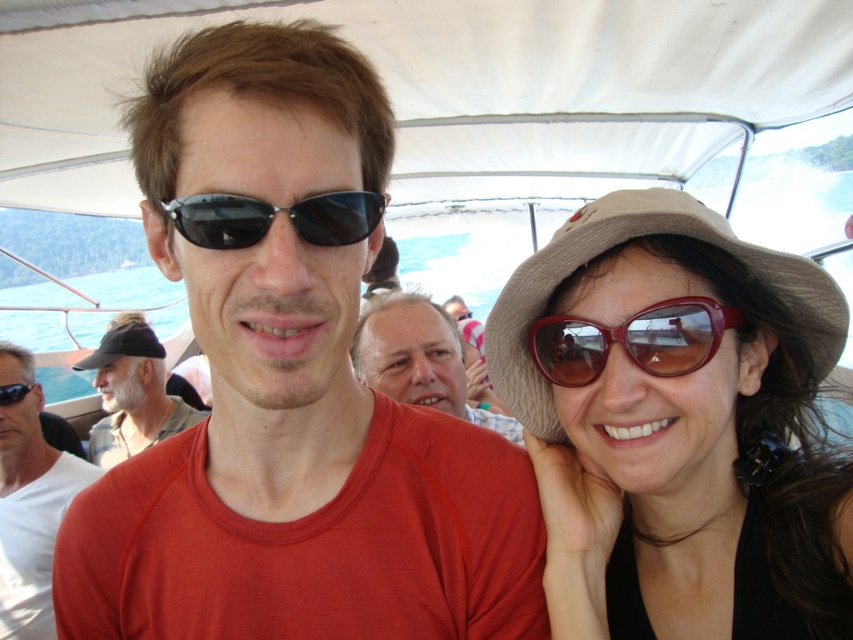
You are a photographer trying to capture a closeup of the matte black sunglasses at center and the black fabric cap at left. Since you want to focus on one object at a time, which object should you zoom in on first to ensure it fits entirely within your camera frame?

The matte black sunglasses at center might be wider than black fabric cap at left, so you should zoom in on the black fabric cap at left first to ensure it fits within the frame before adjusting for the wider sunglasses.

You are a photographer on the boat and want to capture both the matte brown hair at center and the matte black goggles at upper left in the same frame. Given their height difference, will you need to adjust your camera angle upwards or downwards to include both subjects?

The matte brown hair at center is much taller than the matte black goggles at upper left. To include both in the frame, you would need to tilt the camera slightly downward to account for the height difference between the matte brown hair at center and the matte black goggles at upper left.

You are a photographer on the boat and want to take a photo of the brown matte sunglasses at center and the gray fabric cap at center. Which object should you focus on first to ensure both are in focus?

The brown matte sunglasses at center is in front of the gray fabric cap at center, so you should focus on the brown matte sunglasses at center first to ensure both are in focus.